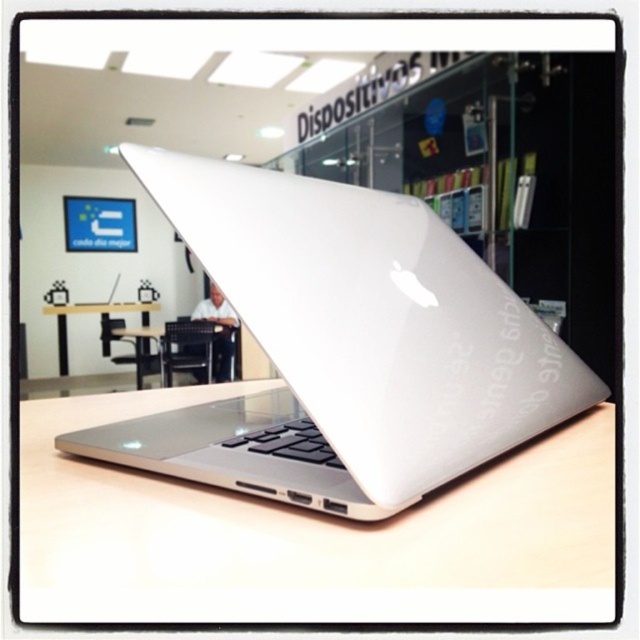
Is the position of black plastic table at center less distant than that of white glossy table at center?

No, black plastic table at center is behind white glossy table at center.

Image resolution: width=640 pixels, height=640 pixels. In order to click on black plastic table at center in this screenshot , I will do `click(195, 349)`.

Who is more distant from viewer, (170, 326) or (99, 305)?

The point (170, 326) is more distant.

Identify the location of black plastic table at center. (195, 349).

Is silver metallic laptop at center further to camera compared to white glossy table at center?

No.

Which of these two, silver metallic laptop at center or white glossy table at center, stands taller?

Standing taller between the two is white glossy table at center.

Find the location of a particular element. silver metallic laptop at center is located at coordinates (346, 346).

I want to click on silver metallic laptop at center, so click(346, 346).

Is silver metallic laptop at center below transparent plastic bookshelf at center?

Correct, silver metallic laptop at center is located below transparent plastic bookshelf at center.

Does silver metallic laptop at center have a lesser height compared to transparent plastic bookshelf at center?

Yes, silver metallic laptop at center is shorter than transparent plastic bookshelf at center.

Who is more forward, (x=257, y=225) or (x=588, y=192)?

Positioned in front is point (x=257, y=225).

Image resolution: width=640 pixels, height=640 pixels. Find the location of `silver metallic laptop at center`. silver metallic laptop at center is located at coordinates (346, 346).